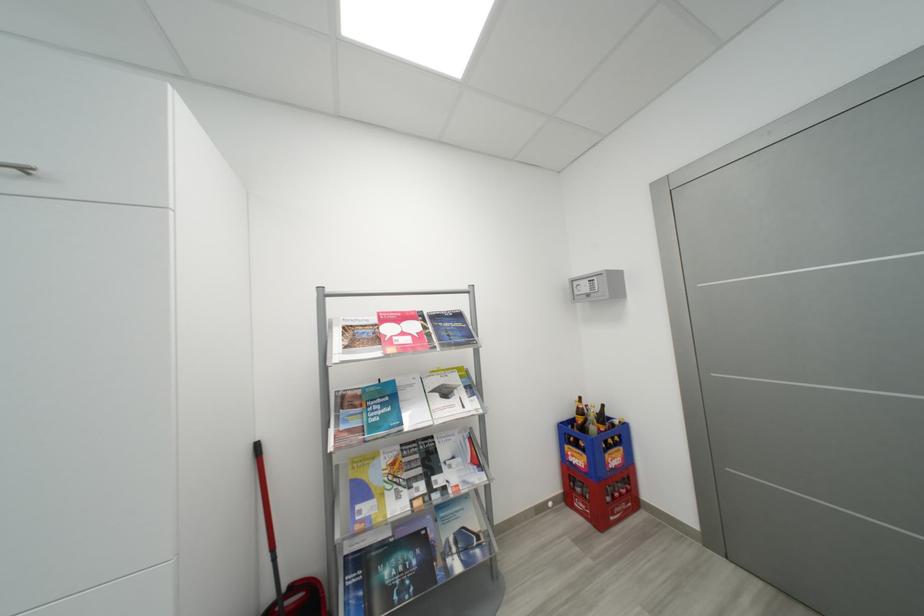
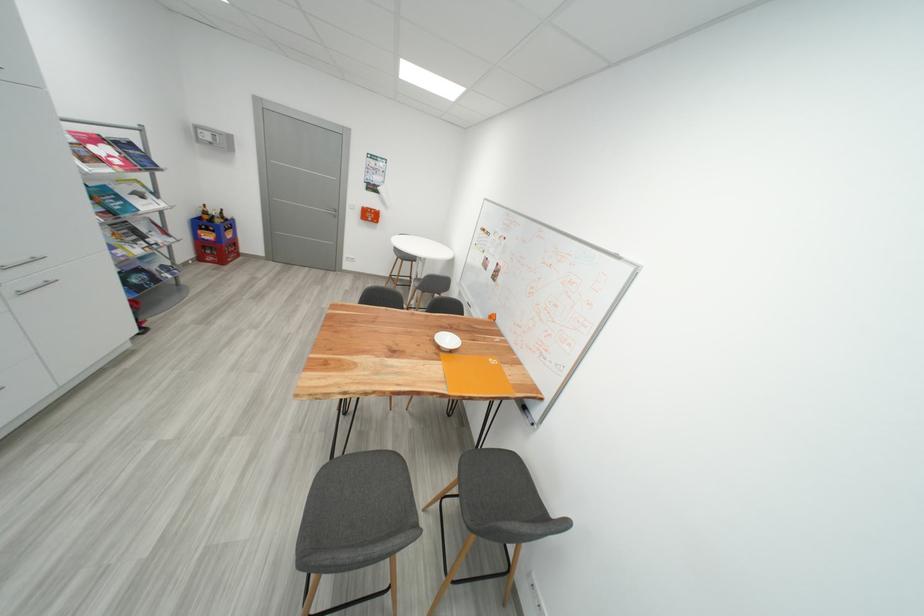
Locate, in the second image, the point that corresponds to point 578,424 in the first image.

(208, 220)